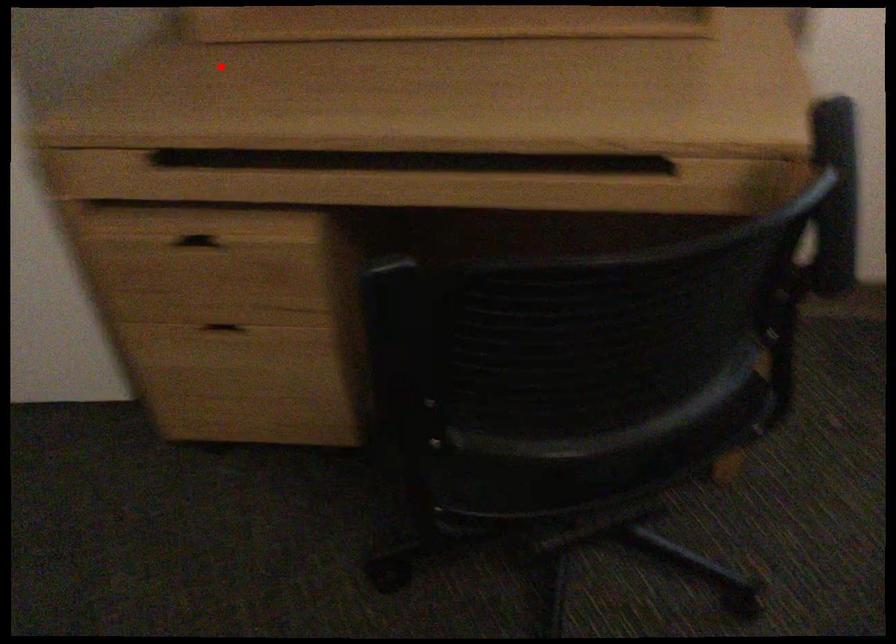
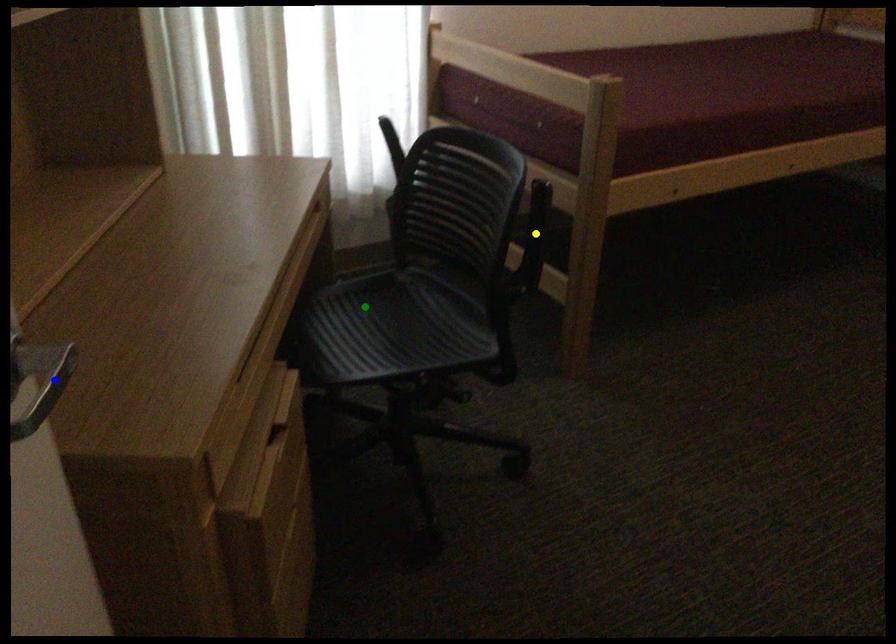
Question: I am providing you with two images of the same scene from different viewpoints. A red point is marked on the first image. You are given multiple points on the second image. In image 2, which mark is for the same physical point as the one in image 1?

Choices:
 (A) green point
 (B) yellow point
 (C) blue point

Answer: (C)